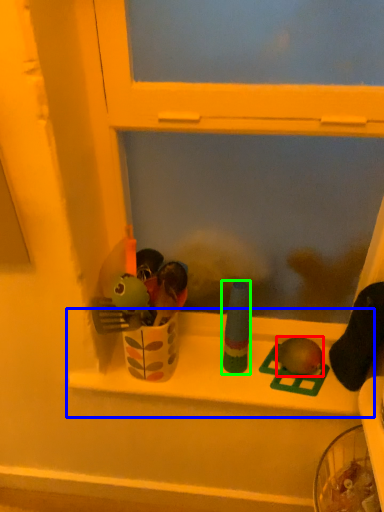
Question: Which object is the closest to the toy (highlighted by a red box)? Choose among these: window sill (highlighted by a blue box) or toy (highlighted by a green box).

Choices:
 (A) window sill
 (B) toy

Answer: (B)